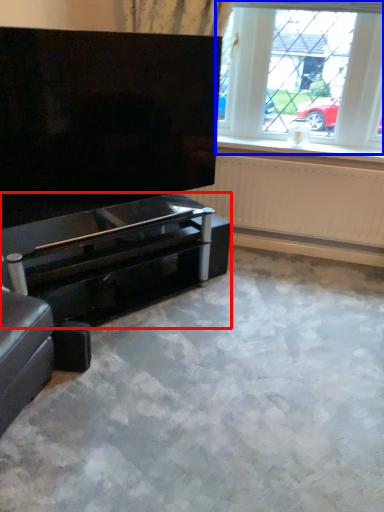
Question: Among these objects, which one is nearest to the camera, piano (highlighted by a red box) or window (highlighted by a blue box)?

Choices:
 (A) piano
 (B) window

Answer: (A)